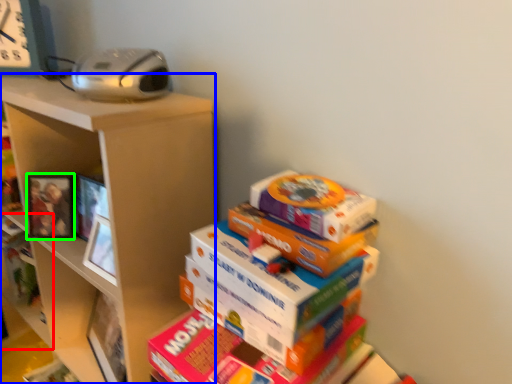
Question: Which object is the closest to the shelf (highlighted by a red box)? Choose among these: shelf (highlighted by a blue box) or picture frame (highlighted by a green box).

Choices:
 (A) shelf
 (B) picture frame

Answer: (B)